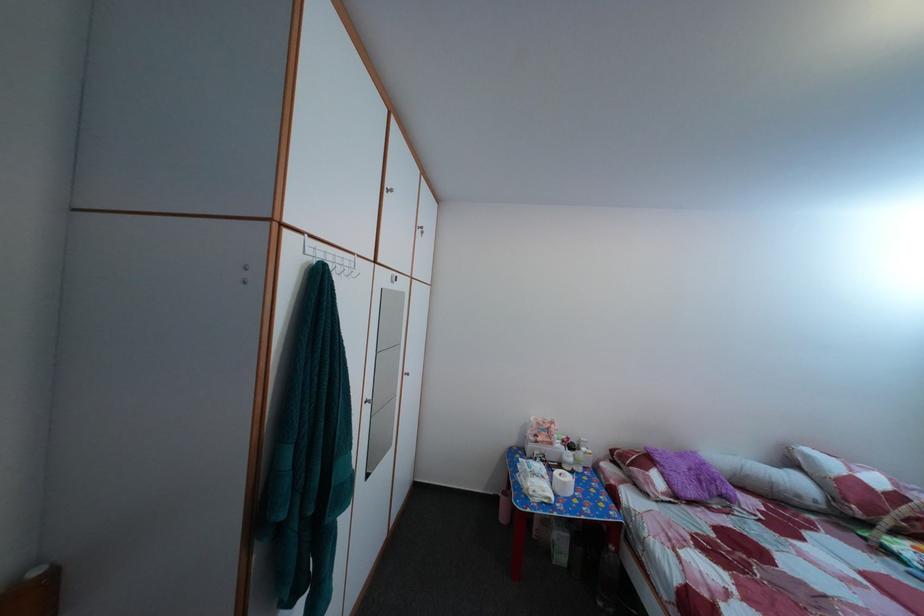
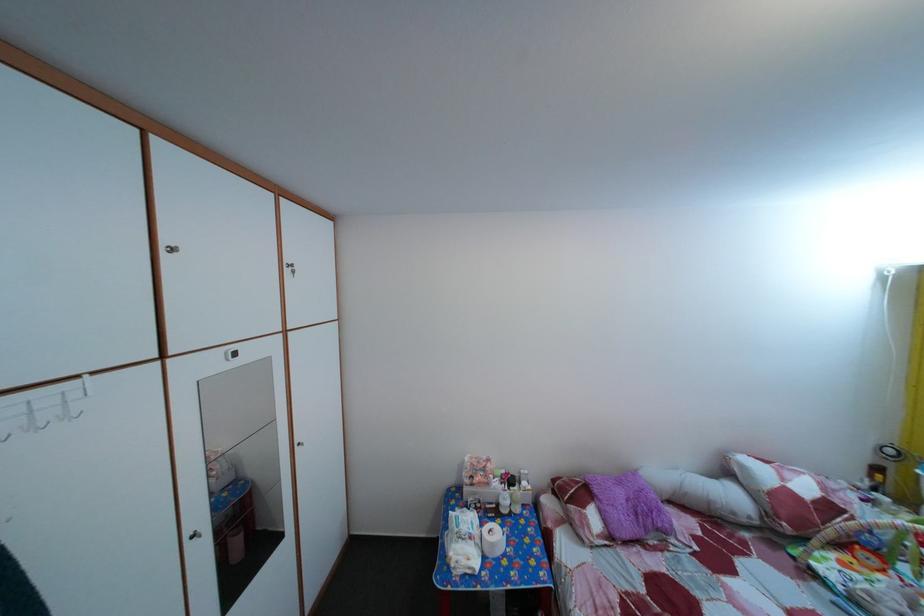
In the second image, find the point that corresponds to pixel 582 451 in the first image.

(524, 485)